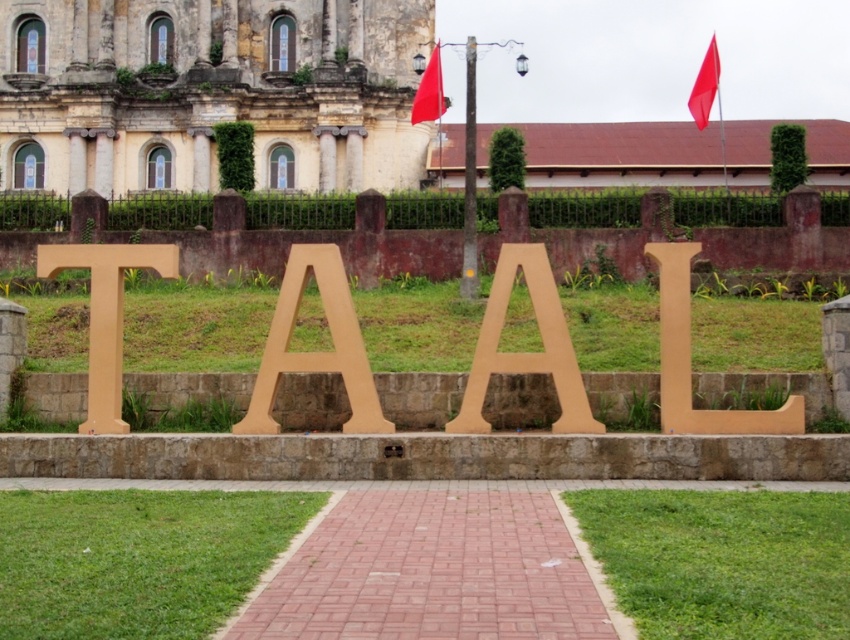
Can you confirm if red brick path at center is positioned below matte cardboard letter a at center?

Yes.

Who is taller, red brick path at center or matte cardboard letter a at center?

matte cardboard letter a at center

Is point (367, 602) positioned after point (496, 362)?

No, (367, 602) is in front of (496, 362).

The image size is (850, 640). In order to click on red brick path at center in this screenshot , I will do `click(434, 570)`.

Who is more forward, (340, 291) or (778, 413)?

Point (778, 413)

Is matte gold letter a at center positioned at the back of matte wood letter l at center?

Yes, it is.

Who is more forward, (319, 356) or (659, 262)?

Point (319, 356) is more forward.

This screenshot has height=640, width=850. In order to click on matte gold letter a at center in this screenshot , I will do `click(315, 352)`.

Does matte gold letter t at left have a greater height compared to matte wood letter l at center?

Correct, matte gold letter t at left is much taller as matte wood letter l at center.

Between matte gold letter t at left and matte wood letter l at center, which one has more height?

Standing taller between the two is matte gold letter t at left.

Locate an element on the screen. The width and height of the screenshot is (850, 640). matte gold letter t at left is located at coordinates (105, 314).

Locate an element on the screen. This screenshot has width=850, height=640. matte gold letter t at left is located at coordinates (105, 314).